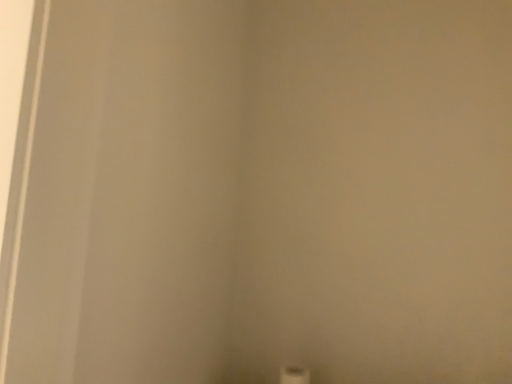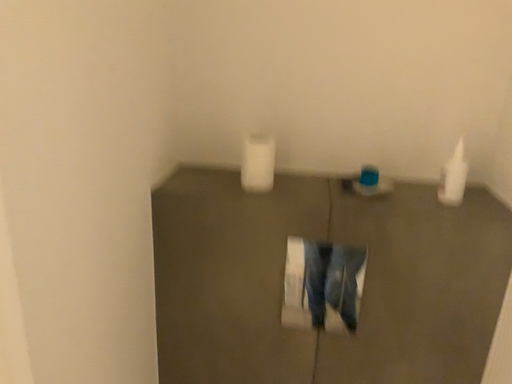
Question: Which way did the camera rotate in the video?

Choices:
 (A) rotated downward
 (B) rotated upward

Answer: (A)